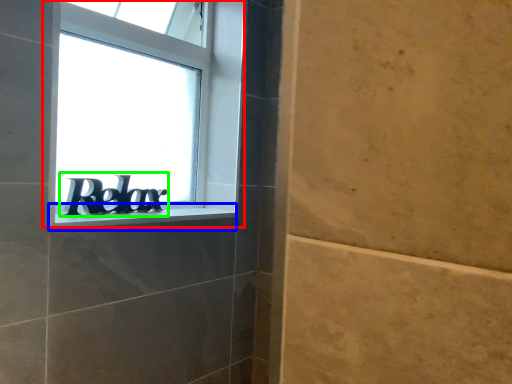
Question: Estimate the real-world distances between objects in this image. Which object is closer to window (highlighted by a red box), window sill (highlighted by a blue box) or number (highlighted by a green box)?

Choices:
 (A) window sill
 (B) number

Answer: (B)